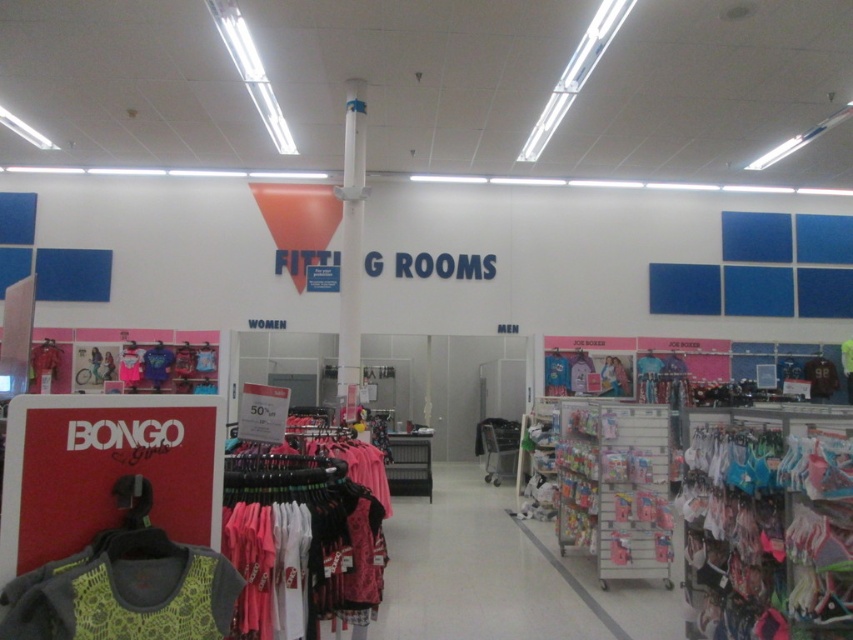
You are a customer in the fitting room section of the store. You see the pink fabric at center and the lime green mesh tank top at lower left. Which item is closer to you?

The pink fabric at center is closer to you because the lime green mesh tank top at lower left is behind it.

You are standing in the retail store and want to locate the fitting rooms. You see a point marked at coordinate (584, 572). Is this point closer to the fitting rooms or the BONGO Girls display?

The point marked at coordinate (584, 572) is 6.42 meters away from the camera. Since the fitting rooms are the main feature in this section of the store, the point is likely closer to the fitting rooms than the BONGO Girls display, which is on the left side of the image.

You are a customer in the store and want to check the height of the pink fabric at center and the lime green mesh tank top at lower left. Which one is taller?

The pink fabric at center is not as tall as the lime green mesh tank top at lower left, so the lime green mesh tank top at lower left is taller.